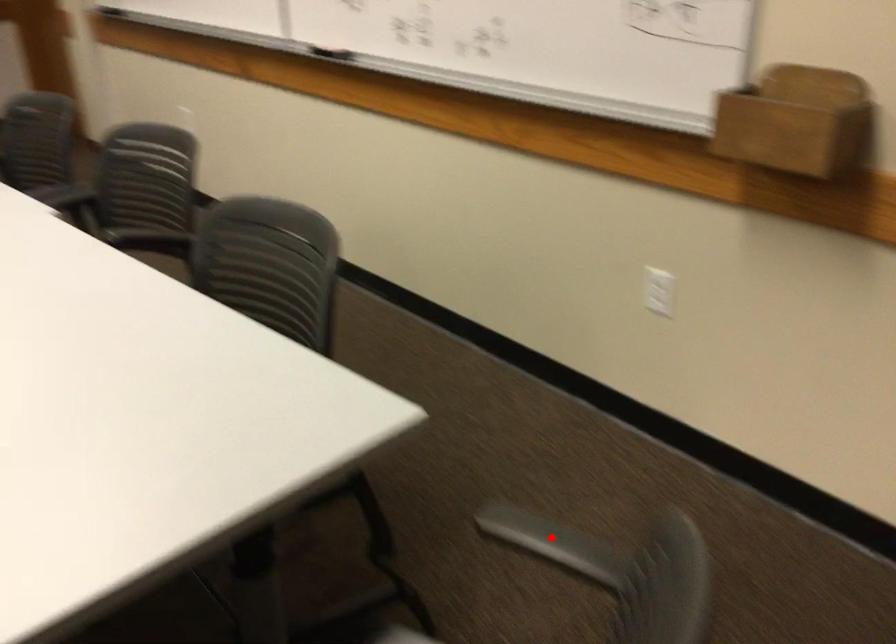
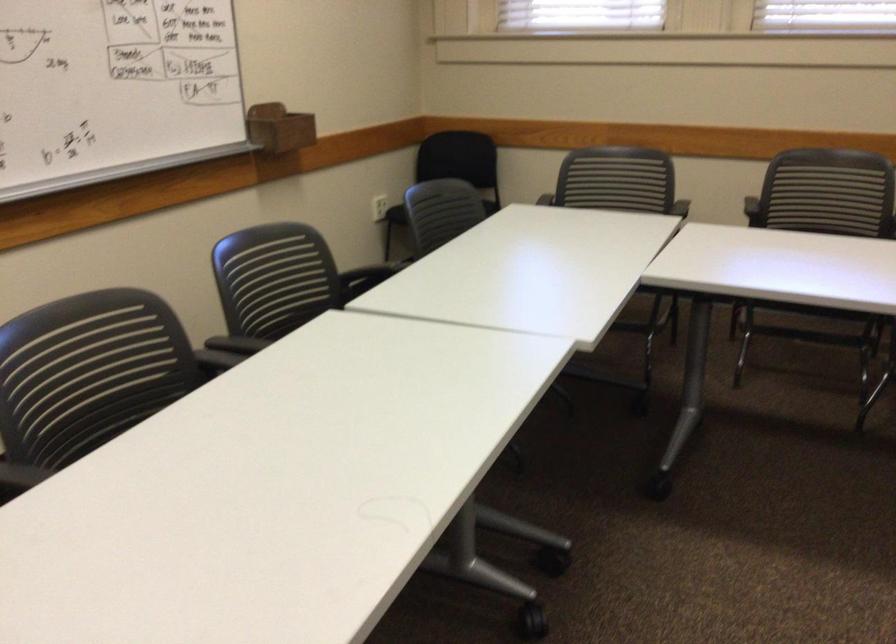
Question: I am providing you with two images of the same scene from different viewpoints. A red point is marked on the first image. Is the red point's position out of view in image 2?

Choices:
 (A) Yes
 (B) No

Answer: (A)